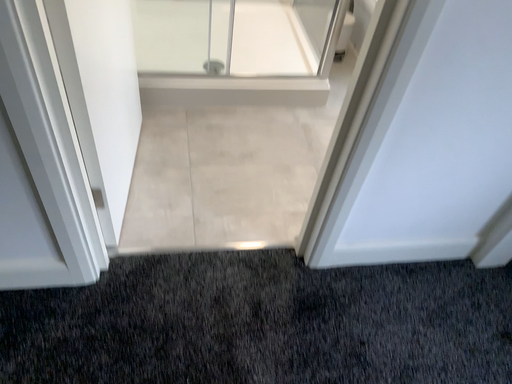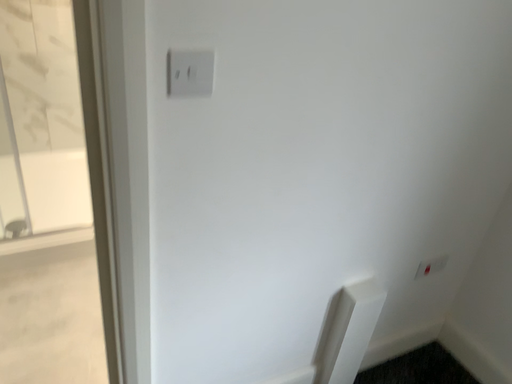
Question: Which way did the camera rotate in the video?

Choices:
 (A) rotated upward
 (B) rotated downward

Answer: (A)